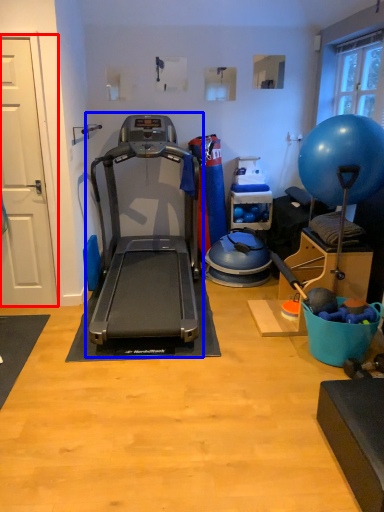
Question: Among these objects, which one is nearest to the camera, door (highlighted by a red box) or treadmill (highlighted by a blue box)?

Choices:
 (A) door
 (B) treadmill

Answer: (B)